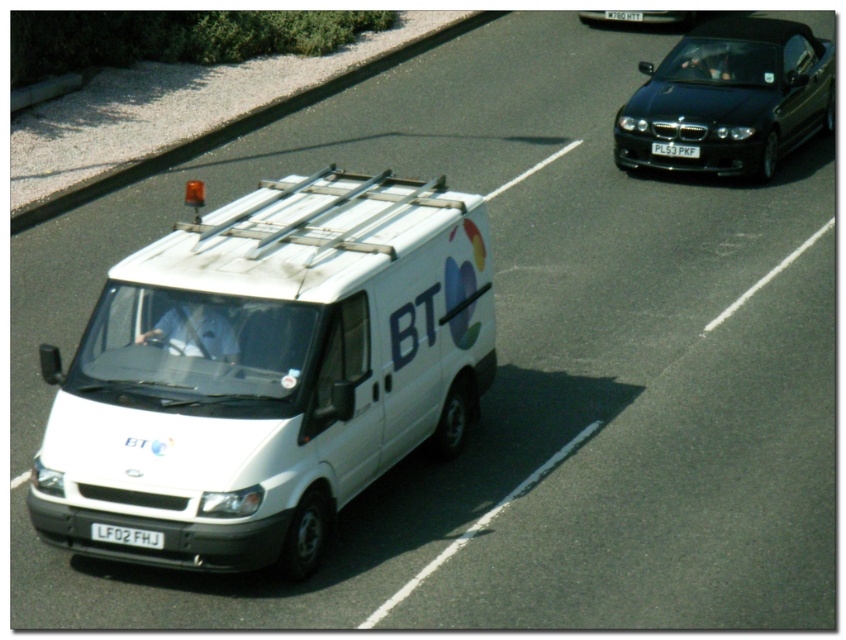
Can you confirm if white matte van at center is smaller than white plastic license plate at lower center?

Actually, white matte van at center might be larger than white plastic license plate at lower center.

Can you confirm if white matte van at center is positioned below white plastic license plate at lower center?

No, white matte van at center is not below white plastic license plate at lower center.

Who is more distant from viewer, (463, 304) or (92, 538)?

Positioned behind is point (463, 304).

The height and width of the screenshot is (640, 846). I want to click on white matte van at center, so click(267, 371).

Is white plastic license plate at center above black plastic license plate at center?

No.

Between white plastic license plate at center and black plastic license plate at center, which one is positioned lower?

white plastic license plate at center is below.

Find the location of `white plastic license plate at center`. white plastic license plate at center is located at coordinates (674, 148).

Identify the location of white plastic license plate at center. The height and width of the screenshot is (640, 846). (674, 148).

Is white plastic license plate at lower center positioned behind black plastic license plate at center?

No, it is in front of black plastic license plate at center.

Between white plastic license plate at lower center and black plastic license plate at center, which one has less height?

white plastic license plate at lower center is shorter.

Between point (150, 547) and point (630, 17), which one is positioned behind?

The point (630, 17) is behind.

Find the location of `white plastic license plate at lower center`. white plastic license plate at lower center is located at coordinates pos(125,536).